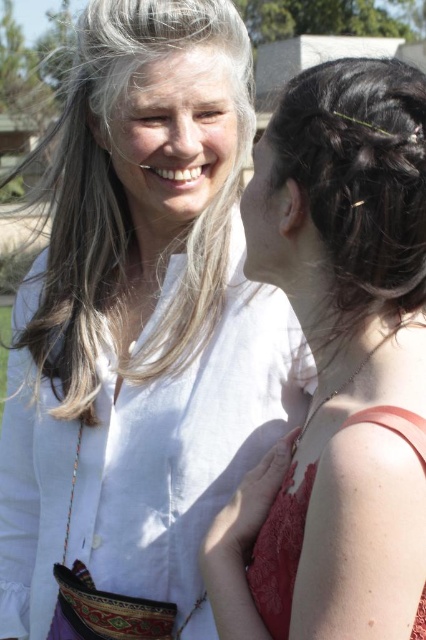
You are standing in front of the two people in the image. Which of the two points, point (301, 580) or point (322, 177), is closer to you?

Point (301, 580) is closer to the viewer than point (322, 177).